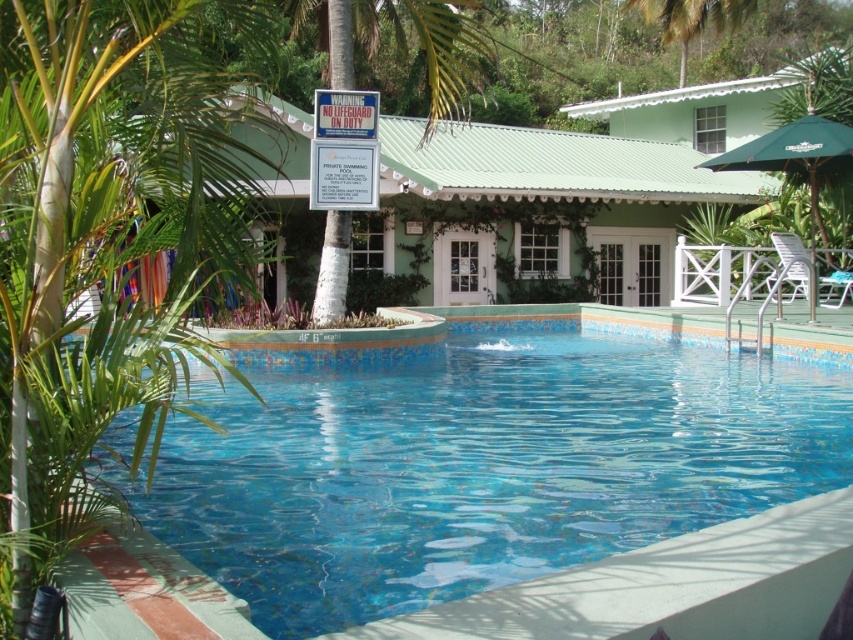
Who is lower down, blue mosaic tiles at center or green matte building at upper center?

Positioned lower is blue mosaic tiles at center.

Does blue mosaic tiles at center lie in front of green matte building at upper center?

That is True.

This screenshot has height=640, width=853. I want to click on blue mosaic tiles at center, so click(x=538, y=500).

Find the location of a particular element. The width and height of the screenshot is (853, 640). blue mosaic tiles at center is located at coordinates pos(538,500).

Is point (683, 168) farther from camera compared to point (718, 20)?

No, it is in front of (718, 20).

From the picture: Which is more to the left, green matte building at upper center or green leafy palm tree at upper center?

green matte building at upper center

At what (x,y) coordinates should I click in order to perform the action: click on green matte building at upper center. Please return your answer as a coordinate pair (x, y). The width and height of the screenshot is (853, 640). Looking at the image, I should click on (532, 211).

This screenshot has height=640, width=853. I want to click on green matte building at upper center, so click(x=532, y=211).

Is green leafy palm tree at left positioned before green matte building at upper center?

Yes.

Between point (33, 458) and point (589, 186), which one is positioned in front?

Point (33, 458)

Identify the location of green leafy palm tree at left. pyautogui.click(x=106, y=230).